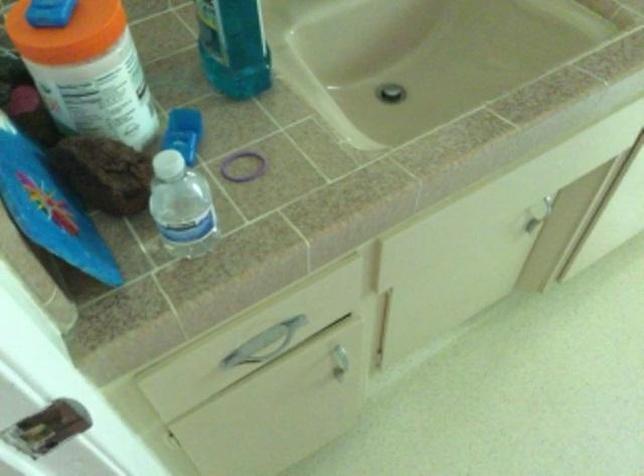
Image resolution: width=644 pixels, height=476 pixels. What are the coordinates of `silver cabinet knob` in the screenshot? It's located at [339, 357].